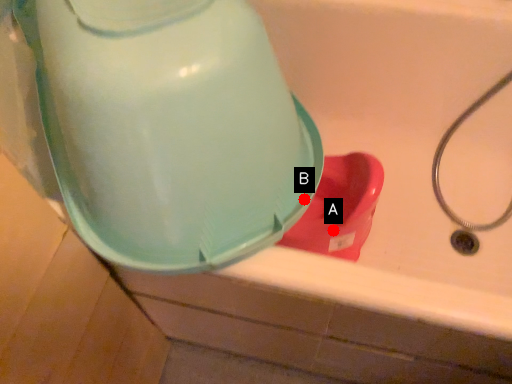
Question: Two points are circled on the image, labeled by A and B beside each circle. Which of the following is the closest to the observer?

Choices:
 (A) A is closer
 (B) B is closer

Answer: (B)